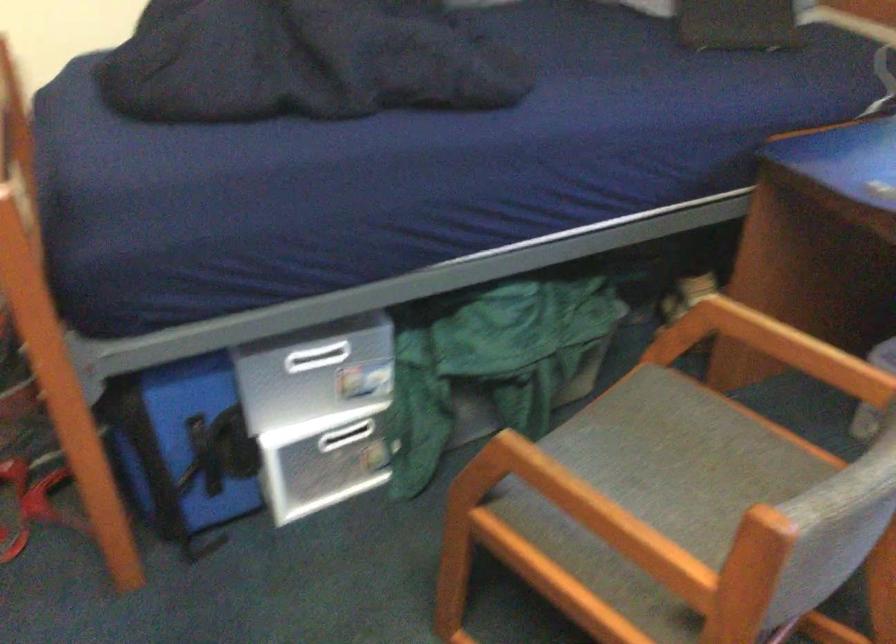
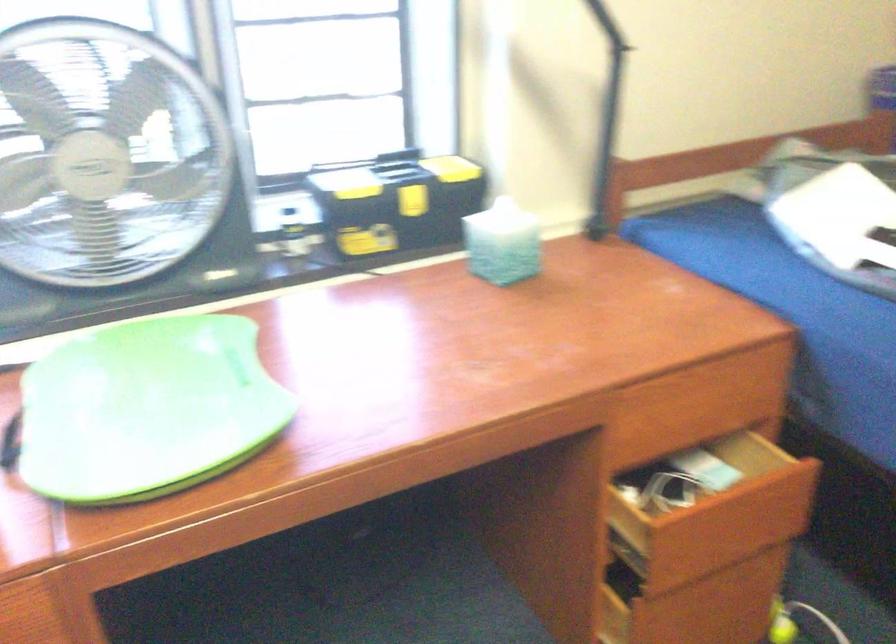
Based on the continuous images, in which direction is the camera rotating?

The camera's rotation is toward right-down.